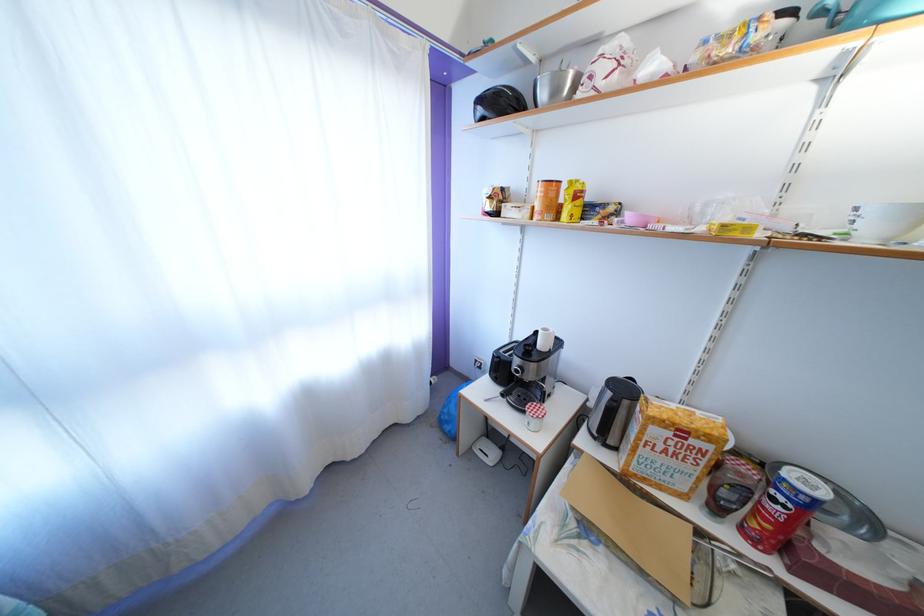
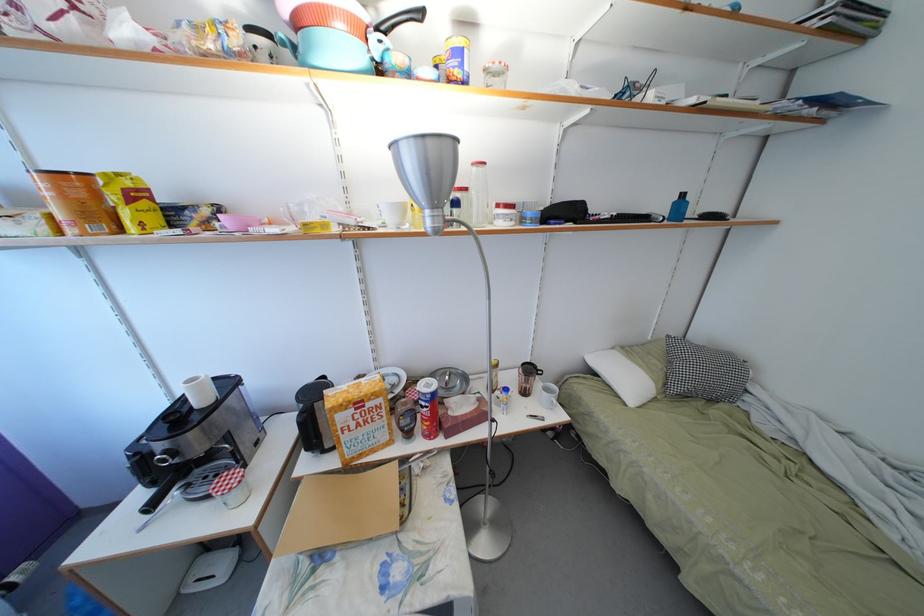
Question: The camera is either moving clockwise (left) or counter-clockwise (right) around the object. The first image is from the beginning of the video and the second image is from the end. Is the camera moving left or right when shooting the video?

Choices:
 (A) Left
 (B) Right

Answer: (A)